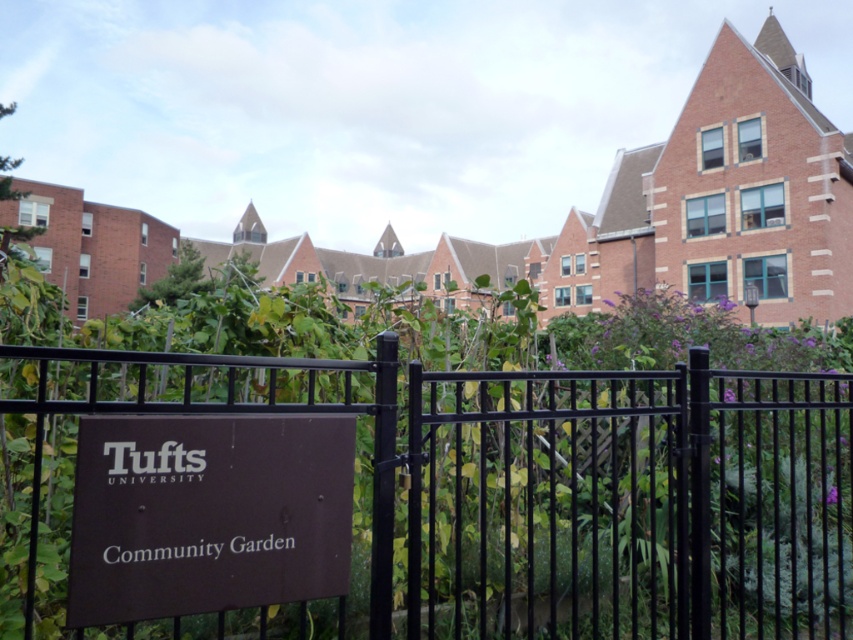
Which of these two, black metal fence at center or brown matte sign at lower center, stands taller?

Standing taller between the two is black metal fence at center.

Looking at this image, which is above, black metal fence at center or brown matte sign at lower center?

brown matte sign at lower center is higher up.

Who is more forward, [323,376] or [210,429]?

Point [210,429]

You are a GUI agent. You are given a task and a screenshot of the screen. Output one action in this format:
    pyautogui.click(x=<x>, y=<y>)
    Task: Click on the black metal fence at center
    
    Given the screenshot: What is the action you would take?
    pyautogui.click(x=538, y=484)